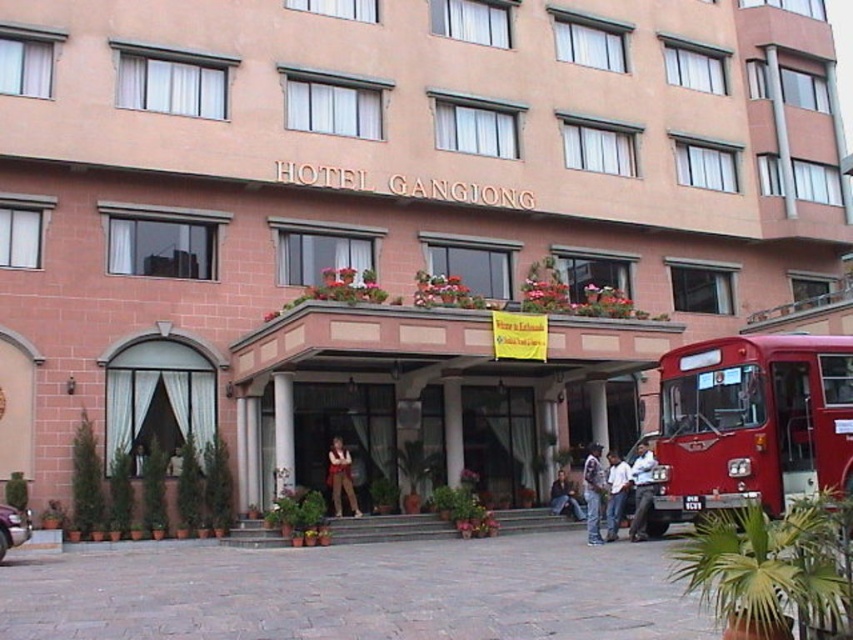
Does white shirt at center have a greater height compared to denim jacket at lower right?

Indeed, white shirt at center has a greater height compared to denim jacket at lower right.

Is the position of white shirt at center less distant than that of denim jacket at lower right?

Yes, it is in front of denim jacket at lower right.

Is point (639, 538) closer to camera compared to point (595, 531)?

No, it is behind (595, 531).

At what (x,y) coordinates should I click in order to perform the action: click on white shirt at center. Please return your answer as a coordinate pair (x, y). This screenshot has width=853, height=640. Looking at the image, I should click on (641, 490).

Is point (596, 456) more distant than point (619, 512)?

That is True.

Between denim jacket at lower right and light brown leather jacket at lower right, which one has less height?

With less height is denim jacket at lower right.

Is point (604, 484) behind point (606, 456)?

No, (604, 484) is in front of (606, 456).

At what (x,y) coordinates should I click in order to perform the action: click on denim jacket at lower right. Please return your answer as a coordinate pair (x, y). The height and width of the screenshot is (640, 853). Looking at the image, I should click on (593, 492).

Which is behind, point (643, 500) or point (619, 481)?

The point (619, 481) is more distant.

Which is above, white shirt at center or light brown leather jacket at lower right?

white shirt at center

Between point (631, 518) and point (619, 472), which one is positioned in front?

Point (619, 472) is in front.

Find the location of a particular element. This screenshot has height=640, width=853. white shirt at center is located at coordinates (641, 490).